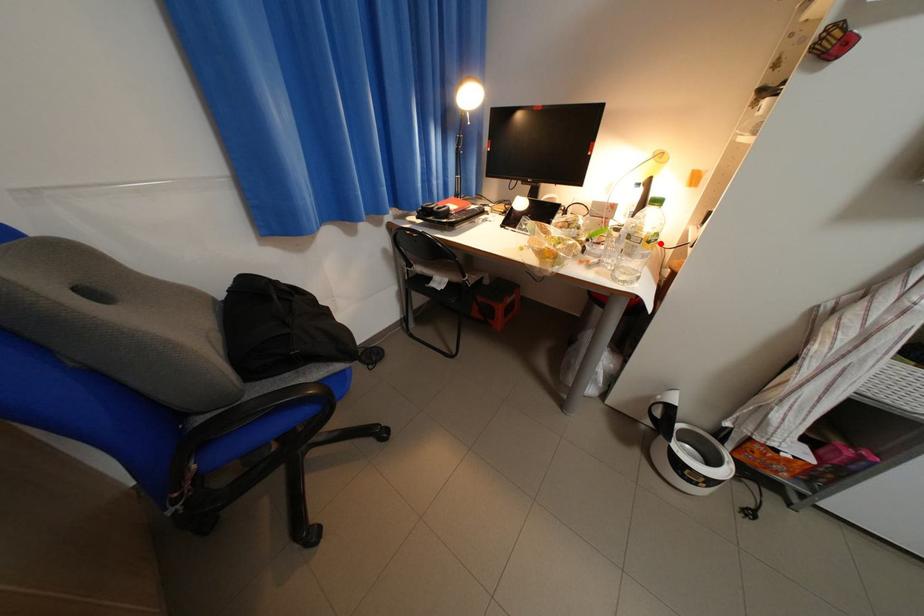
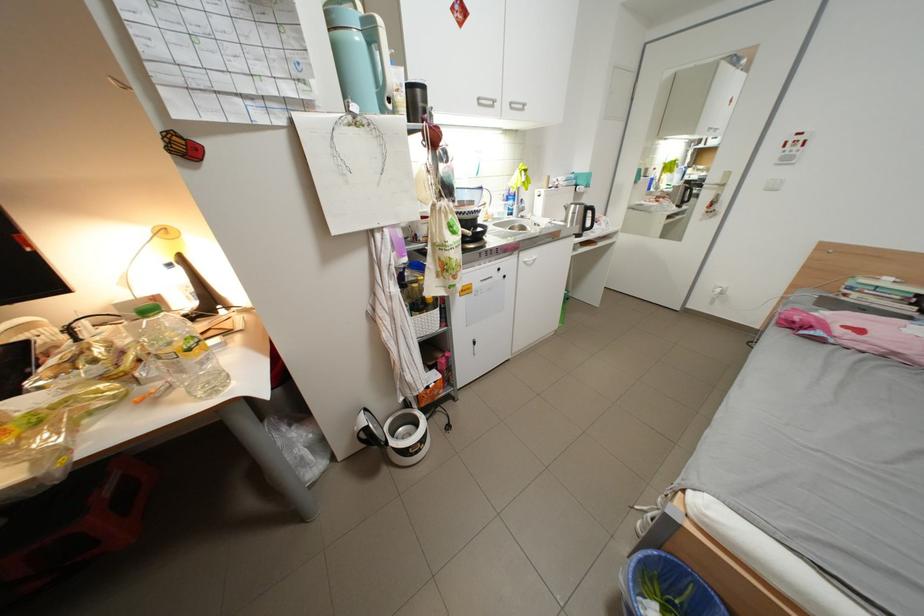
Question: A red point is marked in image1. In image2, is the corresponding 3D point closer to the camera or farther? Reply with the corresponding letter.

Choices:
 (A) The corresponding 3D point is closer.
 (B) The corresponding 3D point is farther.

Answer: (A)